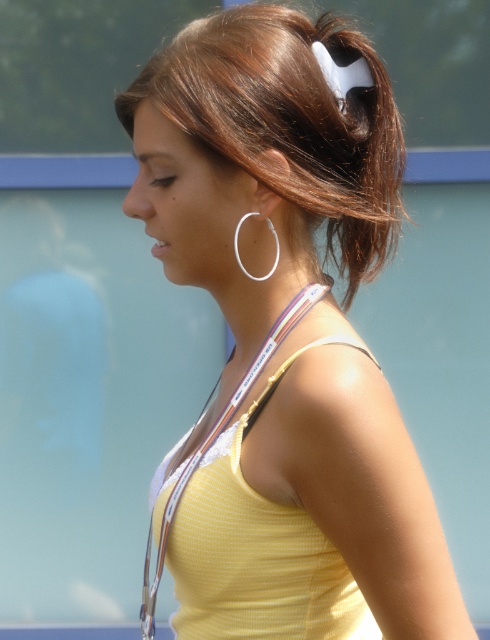
In the scene shown: Which is more to the right, brown shiny hair at upper center or silver metallic hoop at upper center?

brown shiny hair at upper center

Between point (296, 125) and point (276, 252), which one is positioned in front?

Point (296, 125) is in front.

Image resolution: width=490 pixels, height=640 pixels. In order to click on brown shiny hair at upper center in this screenshot , I will do `click(289, 120)`.